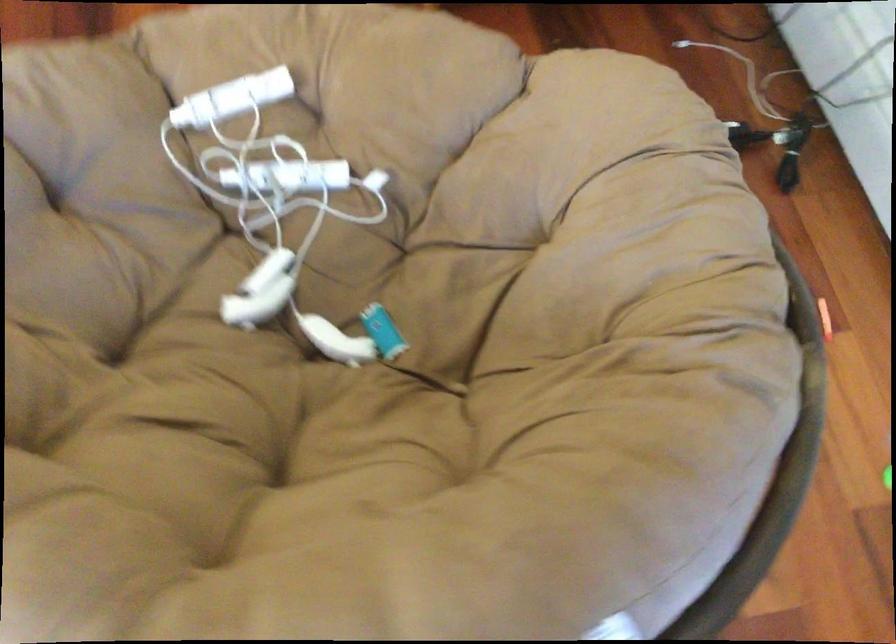
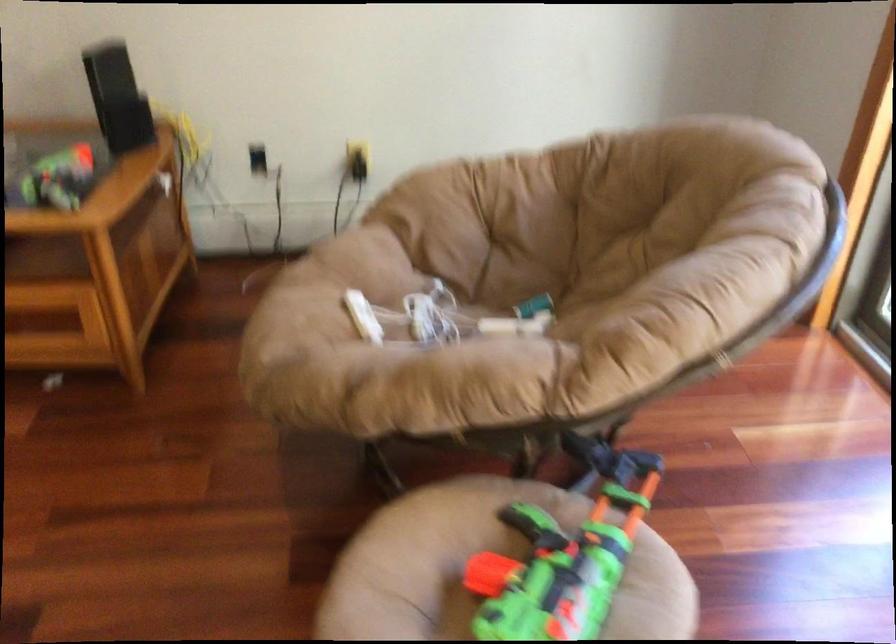
Locate, in the second image, the point that corresponds to point (240, 281) in the first image.

(512, 326)